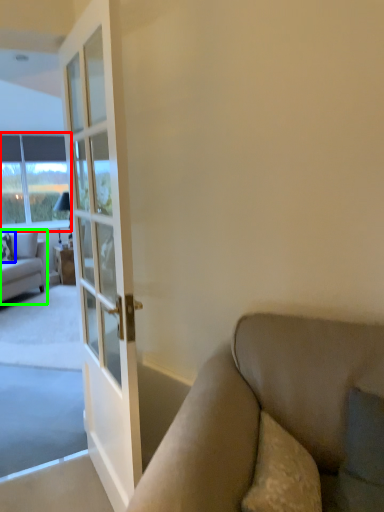
Question: Which object is the closest to the window (highlighted by a red box)? Choose among these: pillow (highlighted by a blue box) or studio couch (highlighted by a green box).

Choices:
 (A) pillow
 (B) studio couch

Answer: (B)